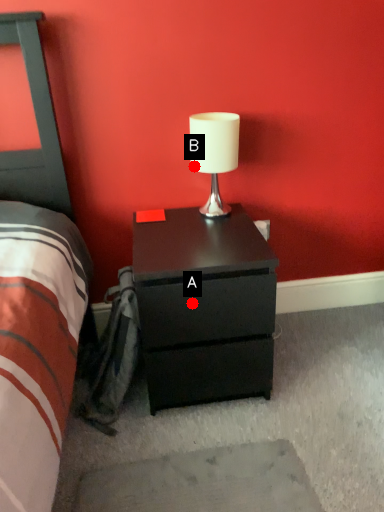
Question: Two points are circled on the image, labeled by A and B beside each circle. Which of the following is the closest to the observer?

Choices:
 (A) A is closer
 (B) B is closer

Answer: (A)